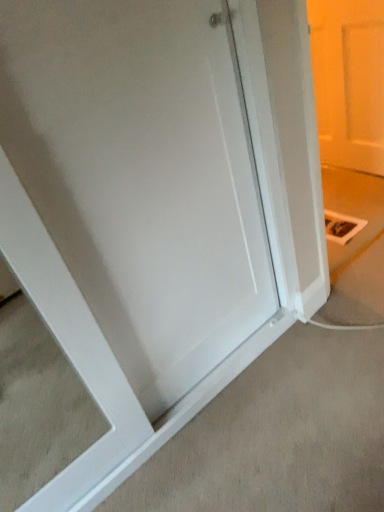
Question: From the image's perspective, is white matte door at upper right on top of white smooth door at center?

Choices:
 (A) yes
 (B) no

Answer: (A)

Question: Can you confirm if white matte door at upper right is thinner than white smooth door at center?

Choices:
 (A) no
 (B) yes

Answer: (B)

Question: Is white matte door at upper right behind white smooth door at center?

Choices:
 (A) yes
 (B) no

Answer: (A)

Question: From a real-world perspective, is white matte door at upper right located higher than white smooth door at center?

Choices:
 (A) no
 (B) yes

Answer: (B)

Question: Can you confirm if white matte door at upper right is wider than white smooth door at center?

Choices:
 (A) no
 (B) yes

Answer: (A)

Question: Is white matte door at upper right not near white smooth door at center?

Choices:
 (A) no
 (B) yes

Answer: (B)

Question: From the image's perspective, is white smooth door at center below white matte door at upper right?

Choices:
 (A) yes
 (B) no

Answer: (A)

Question: Is white smooth door at center outside of white matte door at upper right?

Choices:
 (A) no
 (B) yes

Answer: (B)

Question: Is white smooth door at center bigger than white matte door at upper right?

Choices:
 (A) no
 (B) yes

Answer: (B)

Question: From the image's perspective, would you say white smooth door at center is positioned over white matte door at upper right?

Choices:
 (A) no
 (B) yes

Answer: (A)

Question: Could you tell me if white smooth door at center is turned towards white matte door at upper right?

Choices:
 (A) no
 (B) yes

Answer: (A)

Question: Is white matte door at upper right at the back of white smooth door at center?

Choices:
 (A) yes
 (B) no

Answer: (B)

Question: In the image, is white smooth door at center on the left side or the right side of white matte door at upper right?

Choices:
 (A) left
 (B) right

Answer: (A)